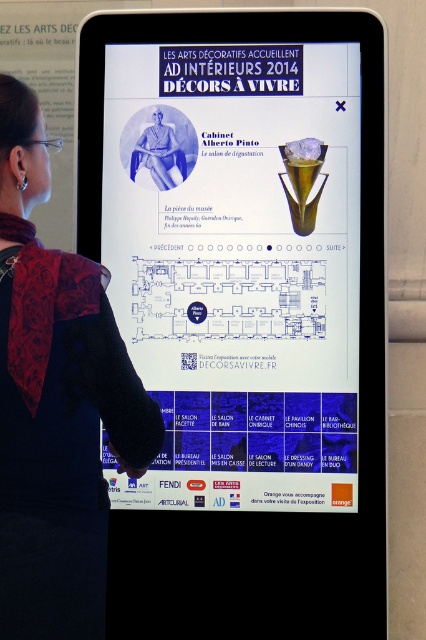
You are an interior designer attending the AD Interieurs 2014 event. You notice two elements on the screen display. Which object is smaller in size between the white glossy poster at center and the black fabric at upper left?

The white glossy poster at center has a smaller size compared to the black fabric at upper left, so the white glossy poster at center is the smaller one.

You are a photographer taking a picture of the screen. You notice two points on the screen at coordinates point (310, 419) and point (3, 378). Which point will appear closer to the edge of the screen in your photo?

Point (3, 378) will appear closer to the edge of the screen because it is positioned lower on the screen compared to point (310, 419).